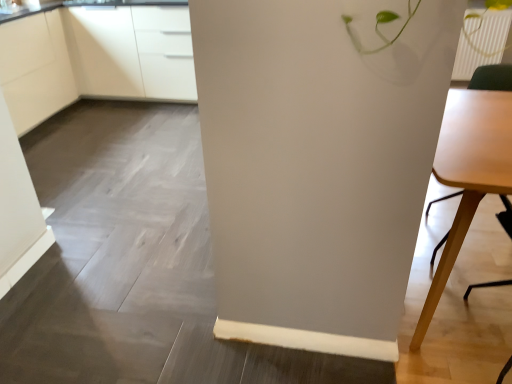
Question: From the image's perspective, is light wood table at right located above or below white glossy cabinets at upper left, which is the first cabinetry in right-to-left order?

Choices:
 (A) above
 (B) below

Answer: (B)

Question: Do you think light wood table at right is within white glossy cabinets at upper left, which is the first cabinetry in right-to-left order, or outside of it?

Choices:
 (A) outside
 (B) inside

Answer: (A)

Question: Considering the real-world distances, which object is closest to the white glossy cabinets at upper left, which is the 2th cabinetry in left-to-right order?

Choices:
 (A) white matte cabinet at upper left, marked as the second cabinetry in a right-to-left arrangement
 (B) light wood table at right

Answer: (A)

Question: Which is farther from the white matte cabinet at upper left, marked as the second cabinetry in a right-to-left arrangement?

Choices:
 (A) light wood table at right
 (B) white glossy cabinets at upper left, which is the first cabinetry in right-to-left order

Answer: (A)